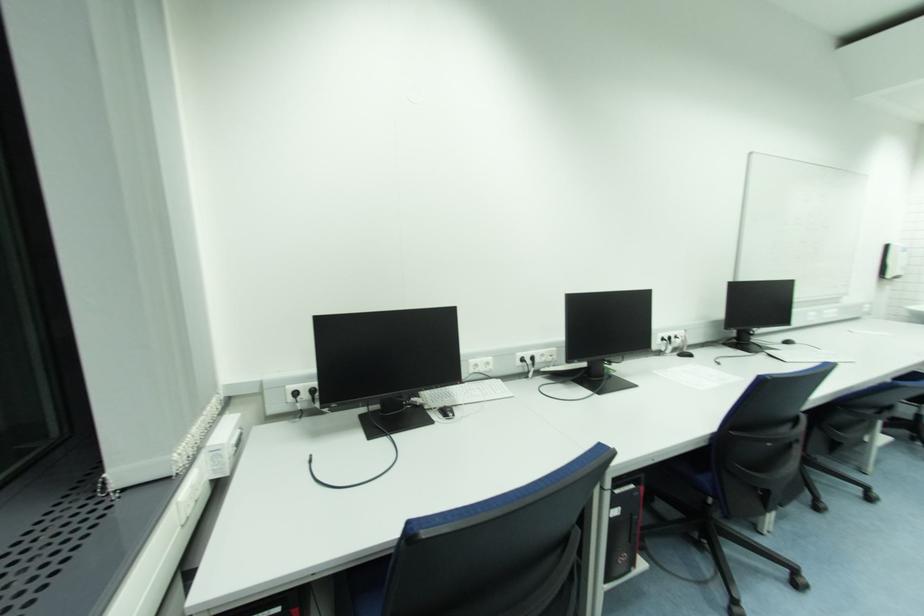
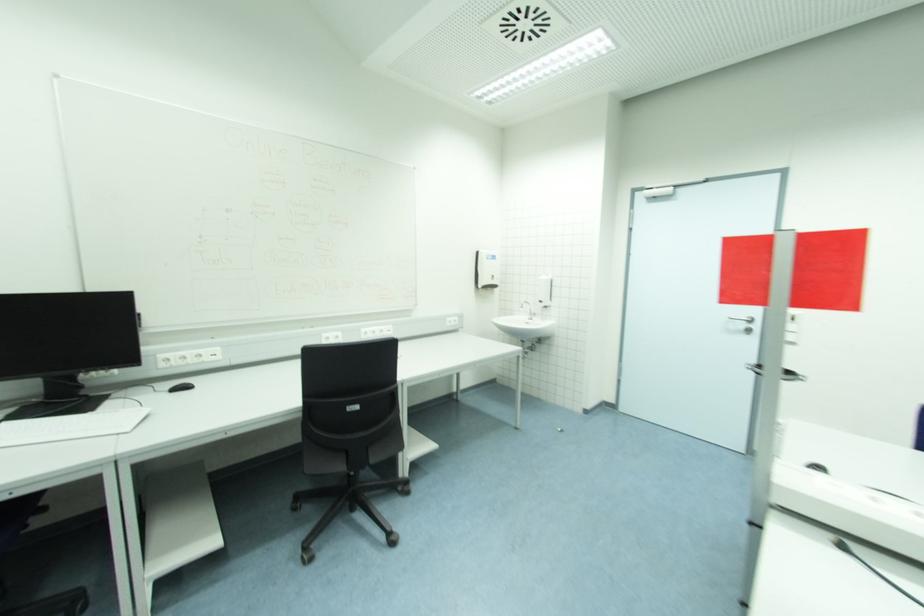
Question: The images are taken continuously from a first-person perspective. In which direction are you moving?

Choices:
 (A) Left
 (B) Right
 (C) Forward
 (D) Backward

Answer: (B)